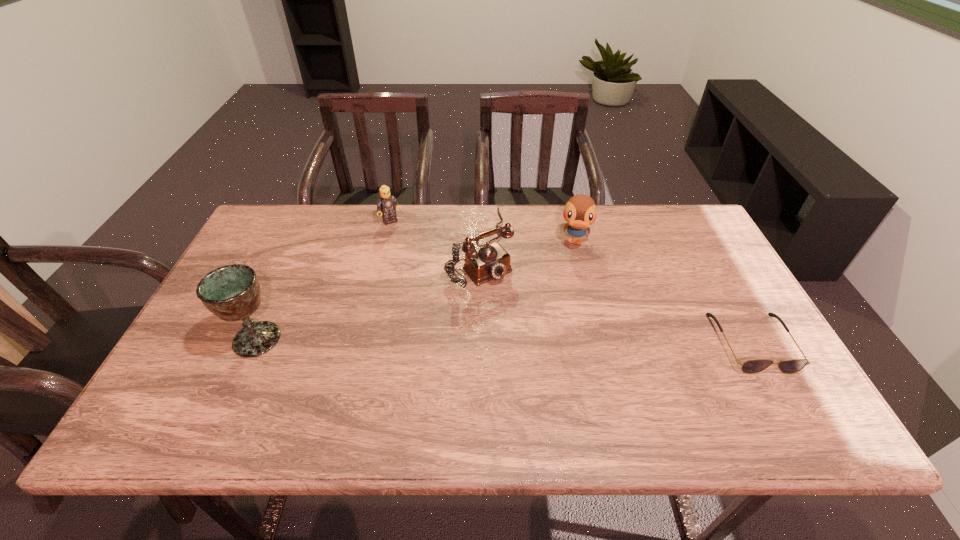
What are the coordinates of `vacant space located 0.090m in front of the Lego` in the screenshot? It's located at (406, 241).

Where is `free point located on the front-facing side of the fourth object from left to right`? This screenshot has height=540, width=960. free point located on the front-facing side of the fourth object from left to right is located at coordinates (569, 332).

Locate an element on the screen. This screenshot has width=960, height=540. vacant space located on the front-facing side of the fourth object from left to right is located at coordinates (569, 332).

The width and height of the screenshot is (960, 540). I want to click on vacant space located 0.130m on the front-facing side of the fourth object from left to right, so click(573, 285).

Identify the location of vacant area located 0.350m on the dial of the third object from right to left. (578, 379).

Locate an element on the screen. free space located on the dial of the third object from right to left is located at coordinates (511, 301).

This screenshot has width=960, height=540. I want to click on vacant region located on the dial of the third object from right to left, so click(x=511, y=301).

Find the location of a particular element. The image size is (960, 540). Lego that is positioned at the far edge is located at coordinates (386, 203).

At what (x,y) coordinates should I click in order to perform the action: click on duck at the far edge. Please return your answer as a coordinate pair (x, y). The width and height of the screenshot is (960, 540). Looking at the image, I should click on (580, 211).

Identify the location of telephone present at the far edge. Image resolution: width=960 pixels, height=540 pixels. (491, 261).